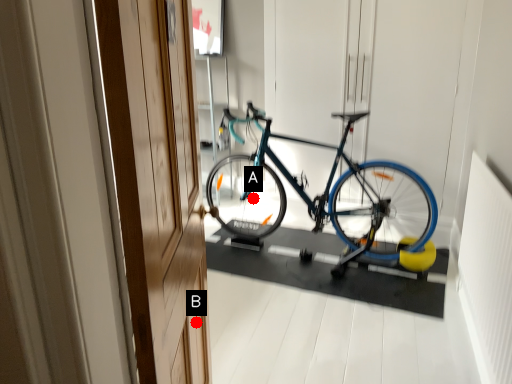
Question: Two points are circled on the image, labeled by A and B beside each circle. Which point is farther from the camera taking this photo?

Choices:
 (A) A is further
 (B) B is further

Answer: (A)